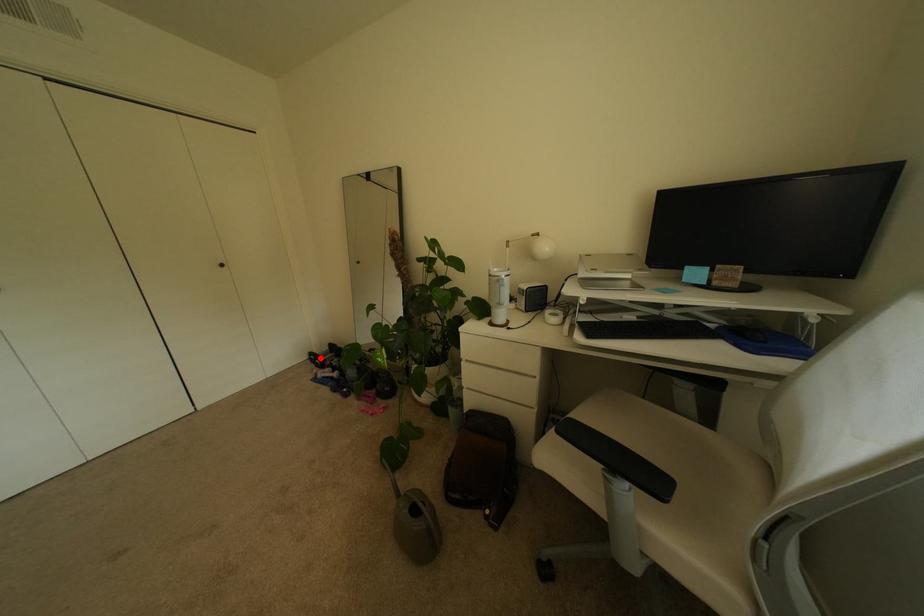
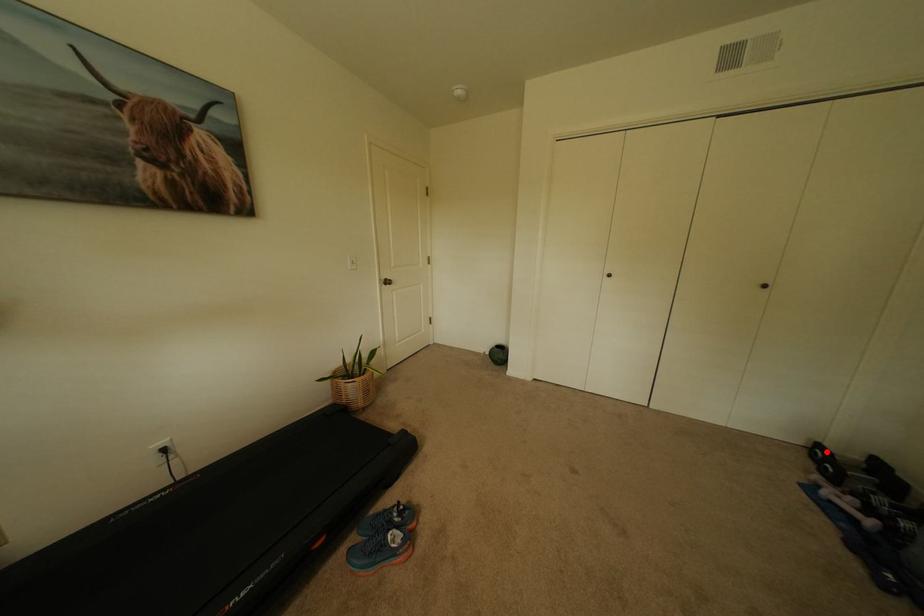
I am providing you with two images of the same scene from different viewpoints. A red point is marked on the first image and another point is marked on the second image. Does the point marked in image1 correspond to the same location as the one in image2?

Yes